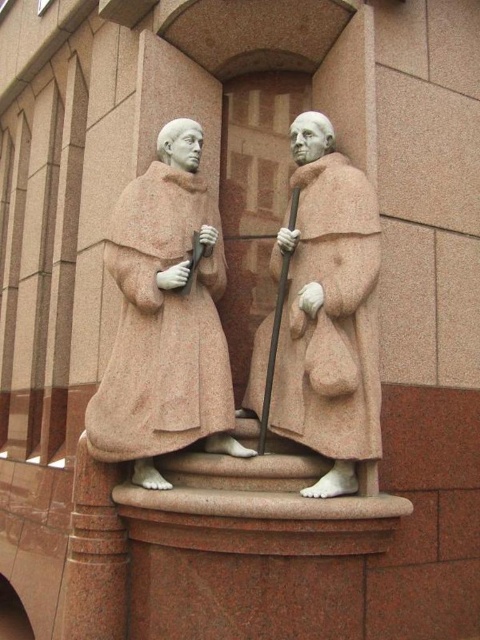
Identify the location of rustic stone robe at center. This screenshot has height=640, width=480. (162, 324).

Based on the photo, who is more forward, (124, 358) or (343, 179)?

Point (124, 358) is more forward.

In order to click on rustic stone robe at center in this screenshot , I will do `click(162, 324)`.